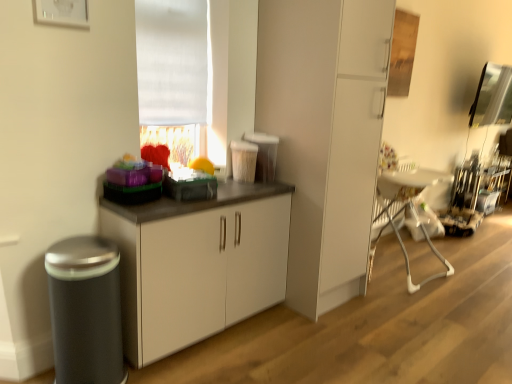
Question: In terms of width, does transparent glass window screen at upper right look wider or thinner when compared to matte black toaster at center, placed as the 2th appliance when sorted from front to back?

Choices:
 (A) wide
 (B) thin

Answer: (A)

Question: From a real-world perspective, is transparent glass window screen at upper right physically located above or below matte black toaster at center, positioned as the 2th appliance in right-to-left order?

Choices:
 (A) below
 (B) above

Answer: (B)

Question: Which object is positioned farthest from the white plastic swivel chair at right?

Choices:
 (A) metallic stainless steel coffee machine at right, placed as the third appliance when sorted from front to back
 (B) white fabric window at upper center
 (C) transparent glass window screen at upper right
 (D) matte black trash can at left, placed as the third appliance when sorted from right to left
 (E) white matte cabinet at center, which appears as the second cabinetry when viewed from the left

Answer: (D)

Question: Which object is the farthest from the white matte cabinet at center, which is the 1th cabinetry in left-to-right order?

Choices:
 (A) white plastic swivel chair at right
 (B) matte black toaster at center, which appears as the 2th appliance when viewed from the left
 (C) transparent glass window screen at upper right
 (D) white matte cabinet at center, marked as the 1th cabinetry in a right-to-left arrangement
 (E) white fabric window at upper center

Answer: (C)